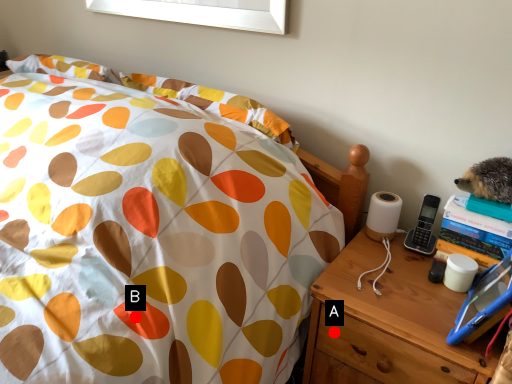
Question: Two points are circled on the image, labeled by A and B beside each circle. Which point is closer to the camera?

Choices:
 (A) A is closer
 (B) B is closer

Answer: (B)